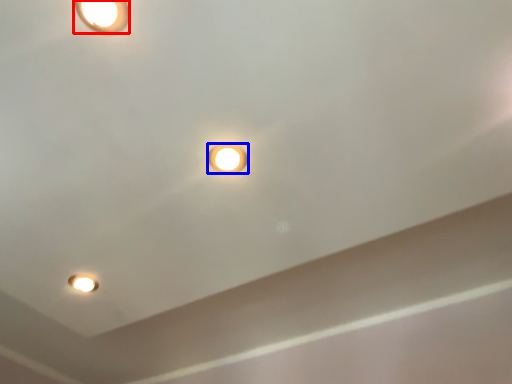
Question: Which object appears farthest to the camera in this image, lamp (highlighted by a red box) or lamp (highlighted by a blue box)?

Choices:
 (A) lamp
 (B) lamp

Answer: (B)